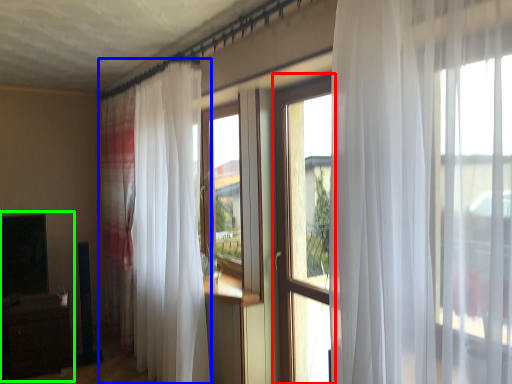
Question: Estimate the real-world distances between objects in this image. Which object is closer to window (highlighted by a red box), curtain (highlighted by a blue box) or entertainment center (highlighted by a green box)?

Choices:
 (A) curtain
 (B) entertainment center

Answer: (A)